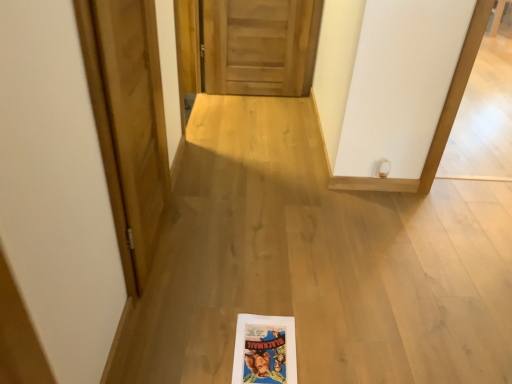
Identify the location of vacant area located to the right-hand side of wooden door at left, which is counted as the second door, starting from the back. (241, 248).